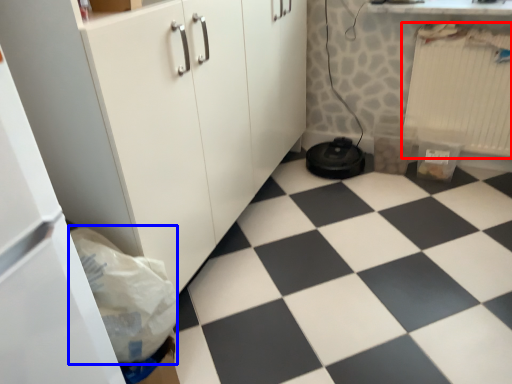
Question: Which object appears closest to the camera in this image, radiator (highlighted by a red box) or garbage (highlighted by a blue box)?

Choices:
 (A) radiator
 (B) garbage

Answer: (B)